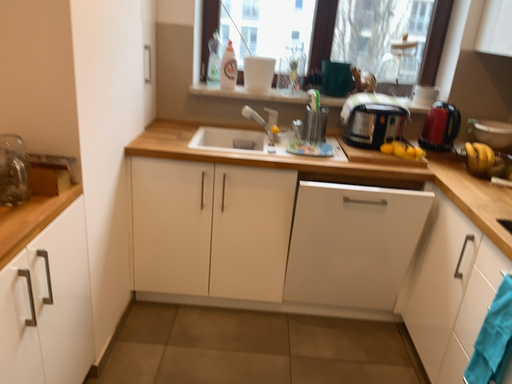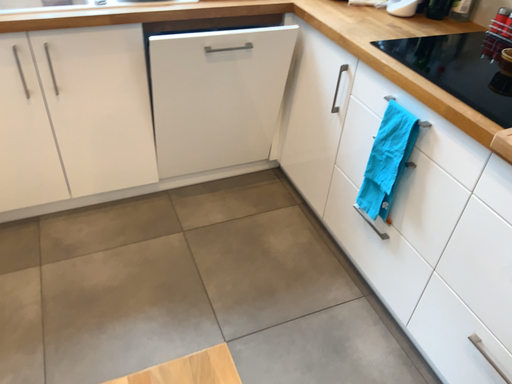
Question: How did the camera likely rotate when shooting the video?

Choices:
 (A) rotated downward
 (B) rotated upward

Answer: (A)